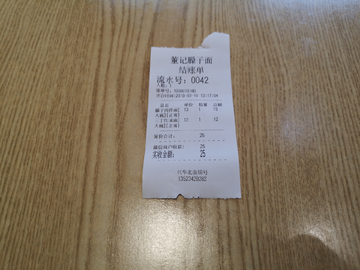
This screenshot has height=270, width=360. Identify the location of wood grain. (269, 157).